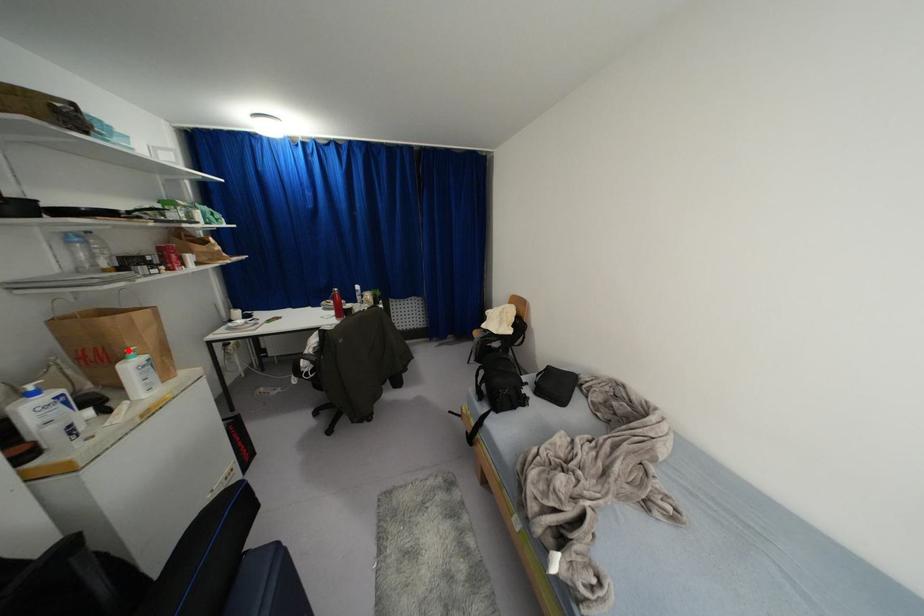
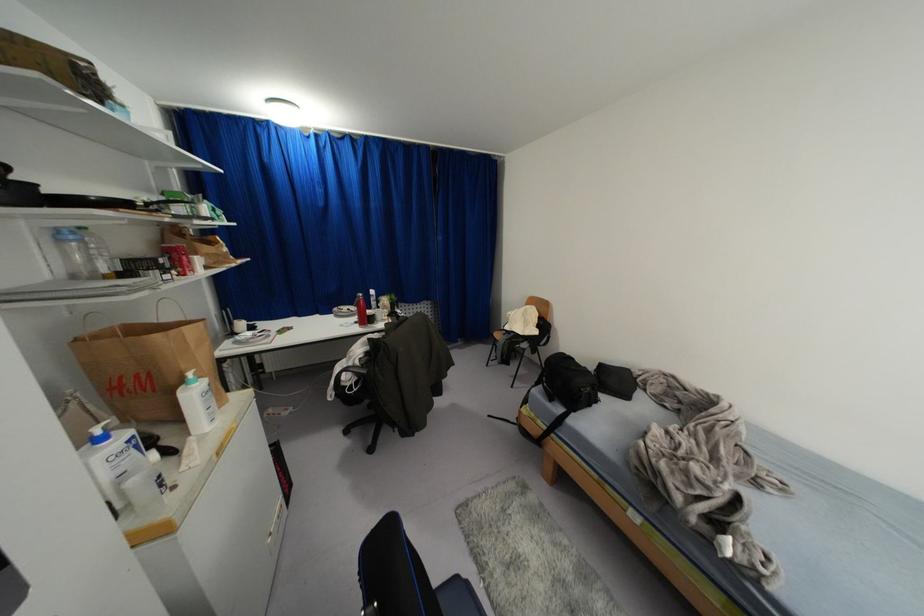
The point at the highlighted location is marked in the first image. Where is the corresponding point in the second image?

(189, 374)